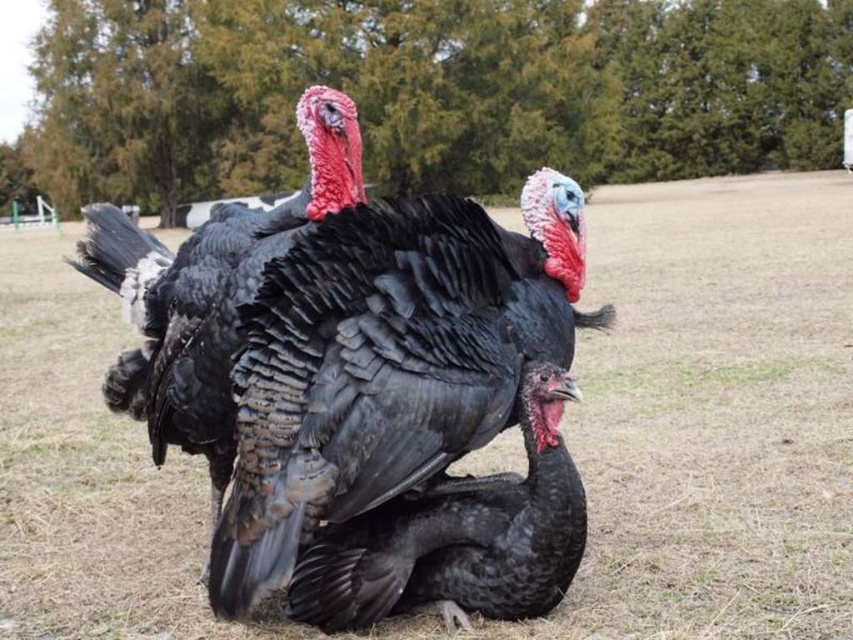
Question: Can you confirm if black matte turkey at center is wider than shiny black turkey at center?

Choices:
 (A) no
 (B) yes

Answer: (A)

Question: Which object is closer to the camera taking this photo?

Choices:
 (A) shiny black turkey at center
 (B) black matte turkey at center

Answer: (B)

Question: Is black matte turkey at center further to camera compared to shiny black turkey at center?

Choices:
 (A) yes
 (B) no

Answer: (B)

Question: Which object is closer to the camera taking this photo?

Choices:
 (A) black matte turkey at center
 (B) shiny black turkey at center

Answer: (A)

Question: Does black matte turkey at center come behind shiny black turkey at center?

Choices:
 (A) yes
 (B) no

Answer: (B)

Question: Which point is closer to the camera?

Choices:
 (A) black matte turkey at center
 (B) shiny black turkey at center

Answer: (A)